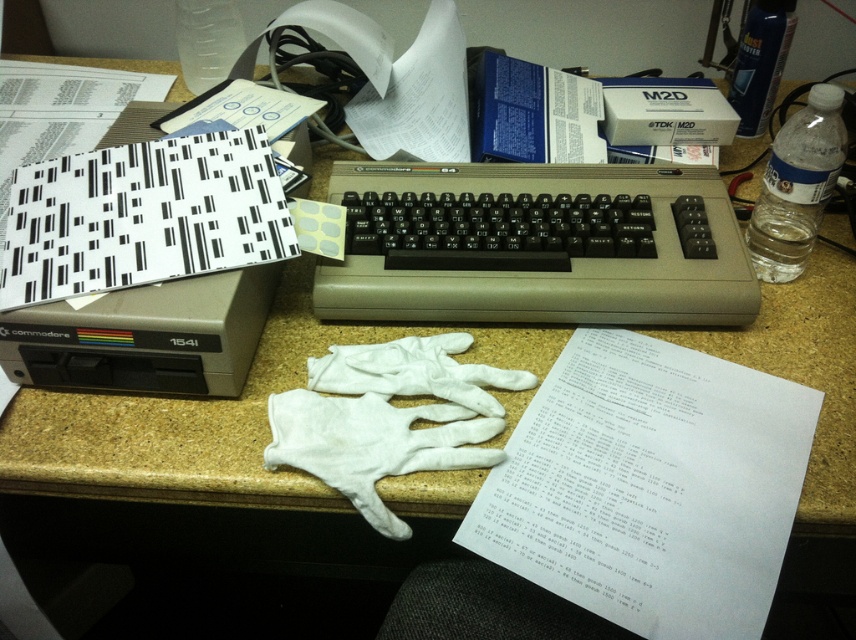
You are organizing a vintage computer exhibit and need to stack items from the workspace. You have a white paper at center and a black plastic keyboard at center. If you want to place one item on top of the other, which one should go on the bottom to ensure stability?

The black plastic keyboard at center should be placed at the bottom since the white paper at center is thinner and would be more stable if placed on top.

You are organizing a vintage computer exhibit and need to place a label on the white paper at center. The label must be placed so it doesn not block the black plastic keyboard at center. Where should you position the label?

The white paper at center is in front of the black plastic keyboard at center, so placing the label on the white paper at center will not block the keyboard since it is already positioned in front.

You are organizing a vintage computer exhibit and need to place a 1 cm thick book on the white paper at center or the beige laminate counter top at center. Which surface can support the book without bending?

The beige laminate counter top at center is thicker than the white paper at center, so it can support the book without bending.